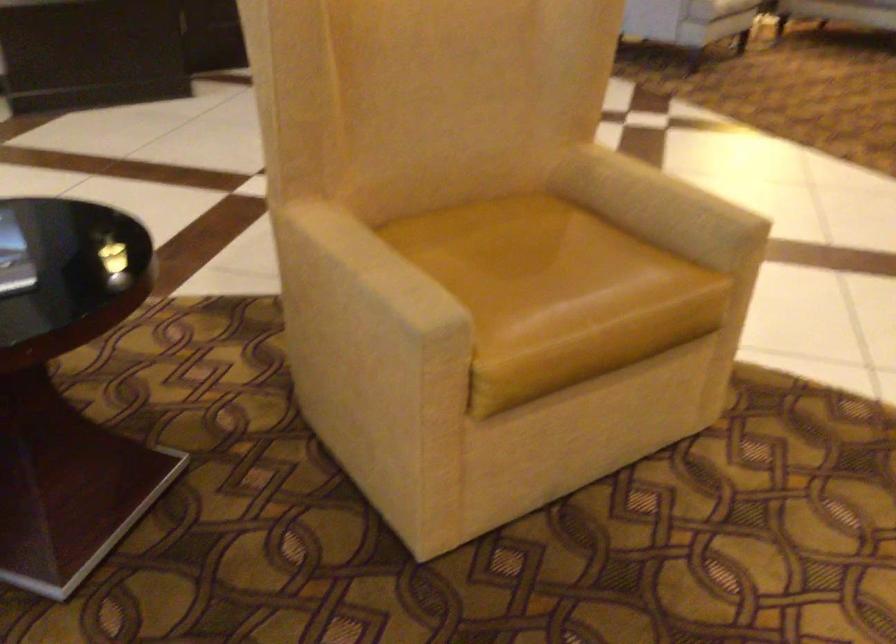
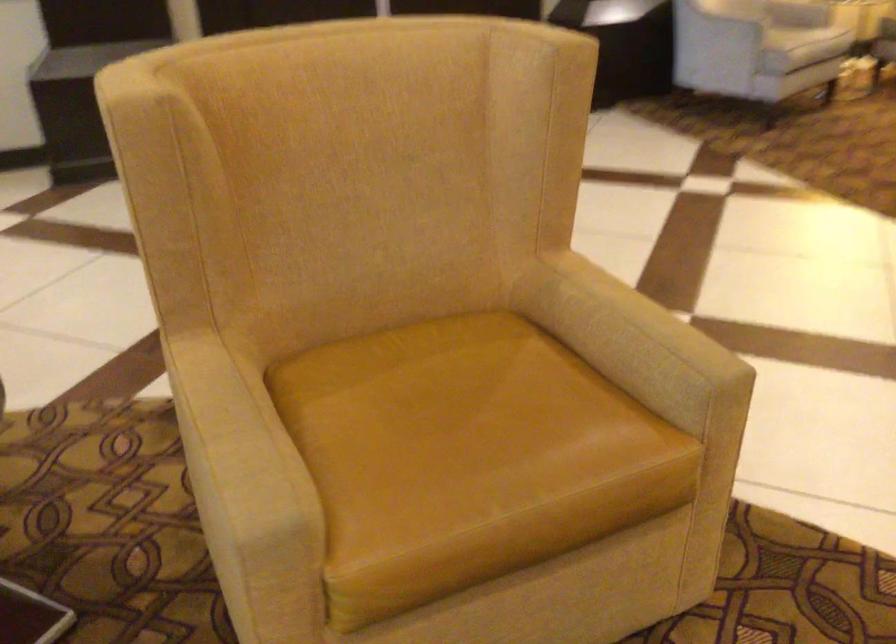
What movement of the cameraman would produce the second image?

Result: The cameraman walked toward right, forward.